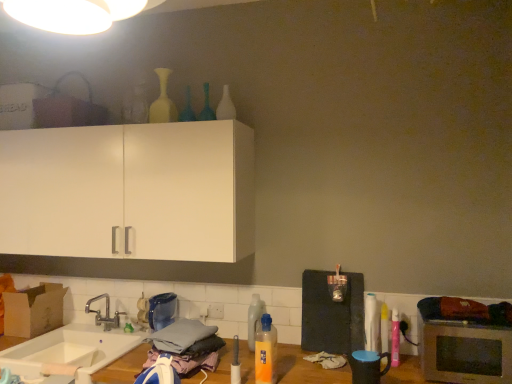
Question: Would you say white glossy bottle at upper center, which is counted as the fifth bottle, starting from the right, contains silver metallic microwave oven at lower right?

Choices:
 (A) no
 (B) yes

Answer: (A)

Question: Can you confirm if white glossy bottle at upper center, which is the 4th bottle from left to right, is positioned to the left of silver metallic microwave oven at lower right?

Choices:
 (A) no
 (B) yes

Answer: (B)

Question: Is white glossy bottle at upper center, which is the 4th bottle from left to right, further to the viewer compared to silver metallic microwave oven at lower right?

Choices:
 (A) no
 (B) yes

Answer: (B)

Question: Is white glossy bottle at upper center, which is the 4th bottle from left to right, outside of silver metallic microwave oven at lower right?

Choices:
 (A) yes
 (B) no

Answer: (A)

Question: From a real-world perspective, is white glossy bottle at upper center, which is counted as the fifth bottle, starting from the right, positioned under silver metallic microwave oven at lower right based on gravity?

Choices:
 (A) yes
 (B) no

Answer: (B)

Question: Considering the relative sizes of white glossy bottle at upper center, which is the 4th bottle from left to right, and silver metallic microwave oven at lower right in the image provided, is white glossy bottle at upper center, which is the 4th bottle from left to right, bigger than silver metallic microwave oven at lower right?

Choices:
 (A) yes
 (B) no

Answer: (B)

Question: Is white glossy bottle at right, which is counted as the second bottle, starting from the right, thinner than translucent glass bottle at upper center, arranged as the sixth bottle when viewed from the right?

Choices:
 (A) yes
 (B) no

Answer: (B)

Question: Does white glossy bottle at right, which is counted as the second bottle, starting from the right, have a greater height compared to translucent glass bottle at upper center, arranged as the sixth bottle when viewed from the right?

Choices:
 (A) yes
 (B) no

Answer: (A)

Question: Considering the relative sizes of white glossy bottle at right, which ranks as the seventh bottle in left-to-right order, and translucent glass bottle at upper center, arranged as the sixth bottle when viewed from the right, in the image provided, is white glossy bottle at right, which ranks as the seventh bottle in left-to-right order, smaller than translucent glass bottle at upper center, arranged as the sixth bottle when viewed from the right,?

Choices:
 (A) yes
 (B) no

Answer: (B)

Question: Is translucent glass bottle at upper center, which is counted as the third bottle, starting from the left, a part of white glossy bottle at right, which ranks as the seventh bottle in left-to-right order?

Choices:
 (A) no
 (B) yes

Answer: (A)

Question: Does white glossy bottle at right, which is counted as the second bottle, starting from the right, have a greater width compared to translucent glass bottle at upper center, arranged as the sixth bottle when viewed from the right?

Choices:
 (A) yes
 (B) no

Answer: (A)

Question: Is white glossy bottle at right, which is counted as the second bottle, starting from the right, behind translucent glass bottle at upper center, which is counted as the third bottle, starting from the left?

Choices:
 (A) yes
 (B) no

Answer: (B)

Question: Can you see white ceramic sink at lower left touching matte white vase at upper center, the first bottle from the left?

Choices:
 (A) no
 (B) yes

Answer: (A)